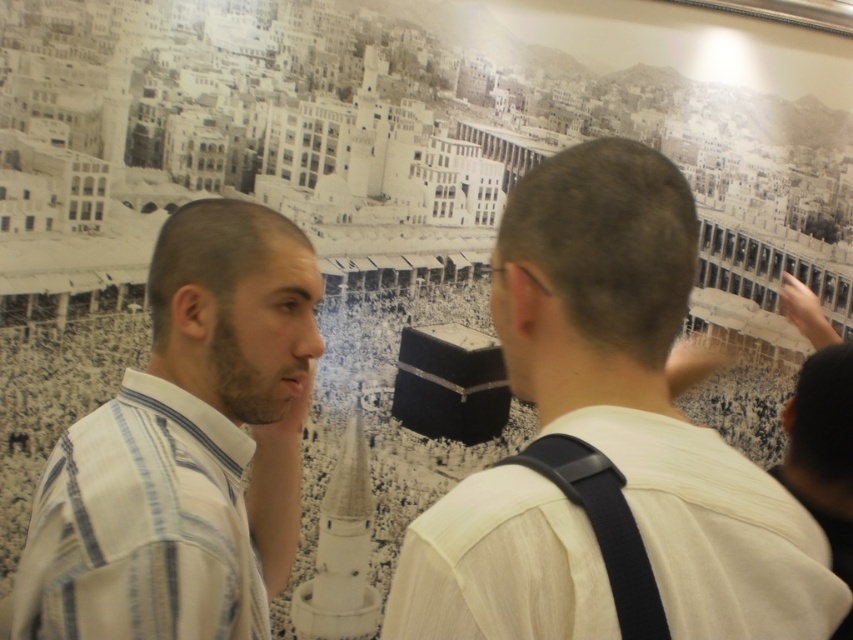
Can you confirm if white shirt at center is shorter than white striped shirt at center?

Yes.

Does white shirt at center appear on the left side of white striped shirt at center?

No, white shirt at center is not to the left of white striped shirt at center.

Where is `white shirt at center`? white shirt at center is located at coordinates (648, 390).

The height and width of the screenshot is (640, 853). In order to click on white shirt at center in this screenshot , I will do `click(648, 390)`.